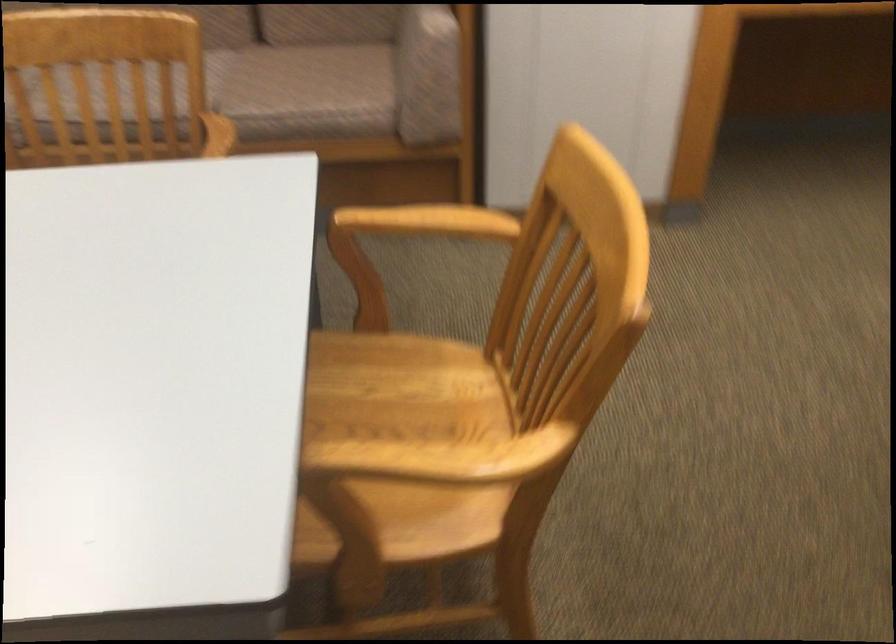
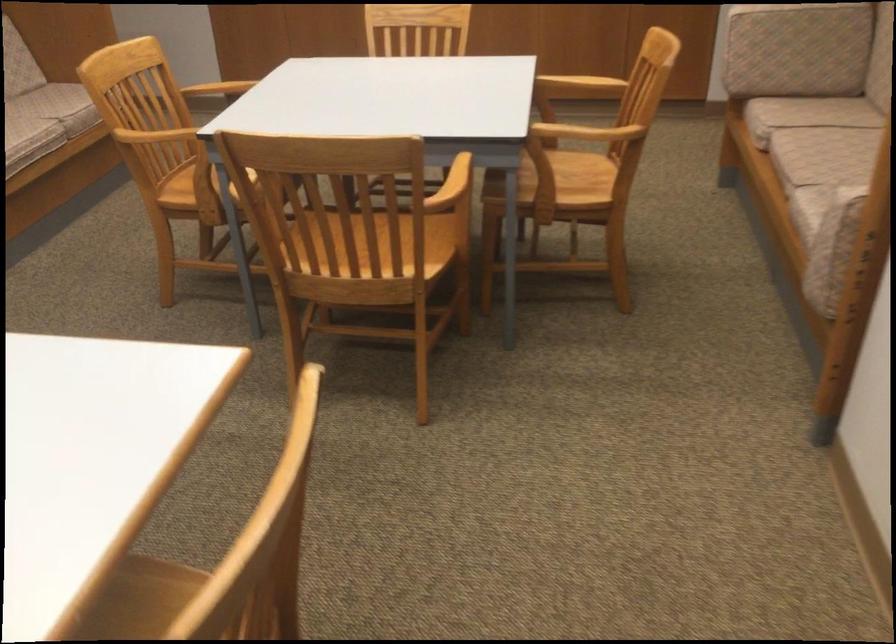
Locate, in the second image, the point that corresponds to the point at 504,388 in the first image.

(358, 259)